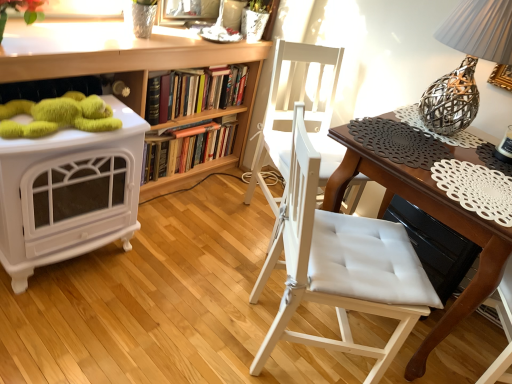
This screenshot has height=384, width=512. I want to click on free spot below green fuzzy toy at upper left (from a real-world perspective), so click(59, 114).